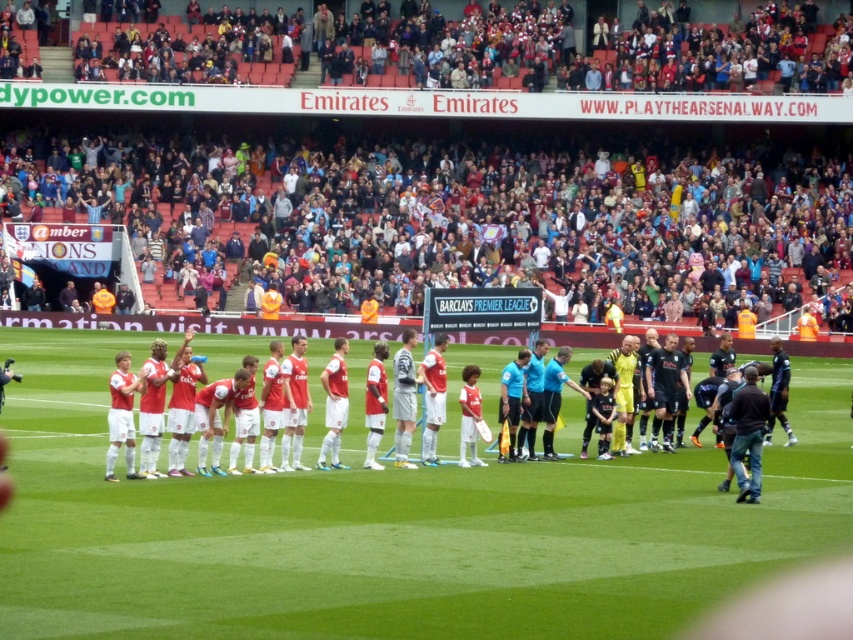
You are a photographer standing at the edge of the green grass field at center, and you want to take a photo of both teams during their pre match ceremony. Can you fit both teams in the frame if your camera has a maximum field of view of 10 meters?

The teams are 11.28 meters apart, which exceeds the camera field of view of 10 meters. Therefore, both teams cannot be captured in a single frame.

You are a photographer standing at the center of the Emirates Stadium pitch during a soccer match. You want to take a photo of two specific points on the pitch marked as point 1 at (300, 598) and point 2 at (294, 346). Which point will appear larger in your photo?

Point 1 at (300, 598) will appear larger in the photo because it is closer to the viewer than point 2 at (294, 346).